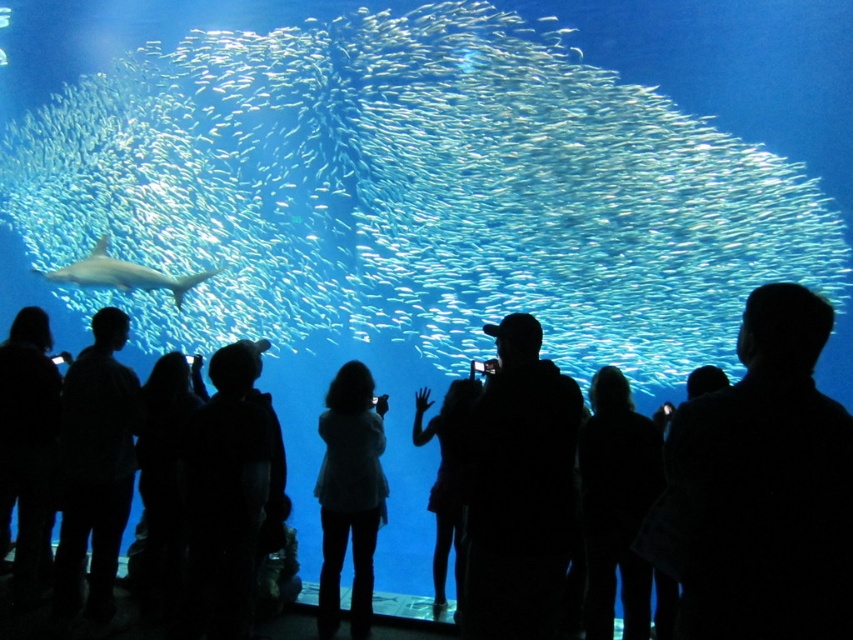
You are standing in the aquarium and see the point at coordinate (448, 477). What object is this point located on?

The point at coordinate (448, 477) is located on the silhouette dress at center.

You are a photographer standing in the aquarium. You see the silhouette dress at center and the smooth gray shark at center. Which object is positioned lower in the image?

The silhouette dress at center is positioned below the smooth gray shark at center, so the silhouette dress at center is lower in the image.